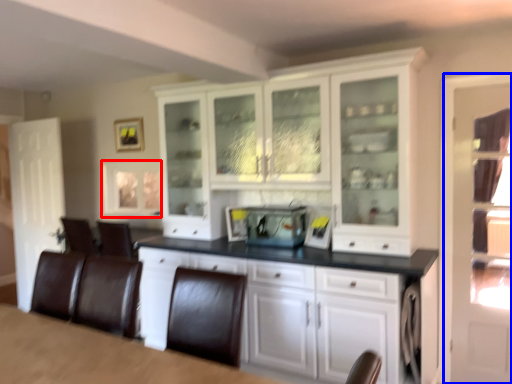
Question: Which point is further to the camera, window (highlighted by a red box) or glass door (highlighted by a blue box)?

Choices:
 (A) window
 (B) glass door

Answer: (A)